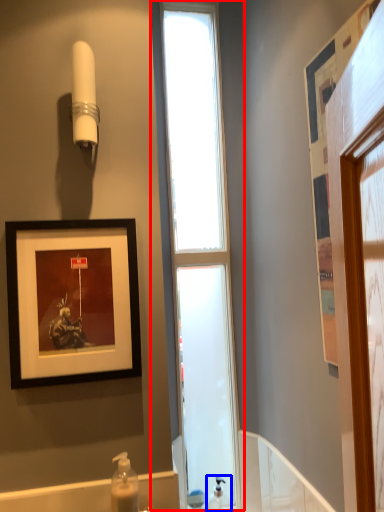
Question: Which point is closer to the camera, window (highlighted by a red box) or soap dispenser (highlighted by a blue box)?

Choices:
 (A) window
 (B) soap dispenser

Answer: (B)